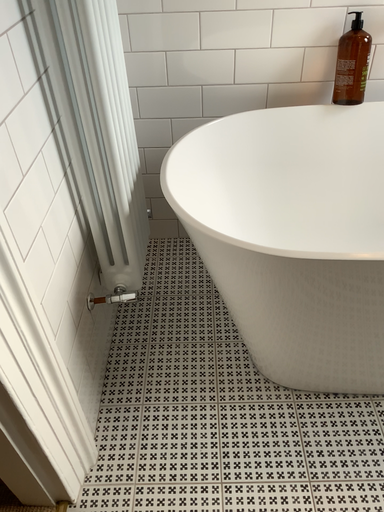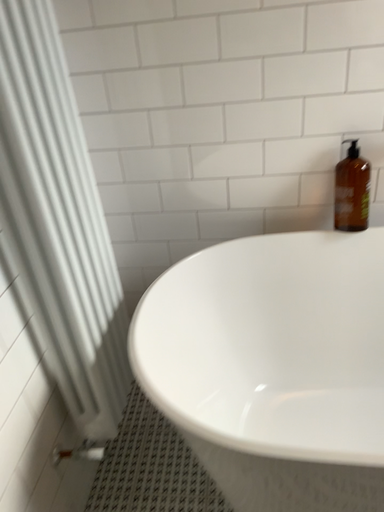
Question: Which way did the camera rotate in the video?

Choices:
 (A) rotated right
 (B) rotated left

Answer: (B)